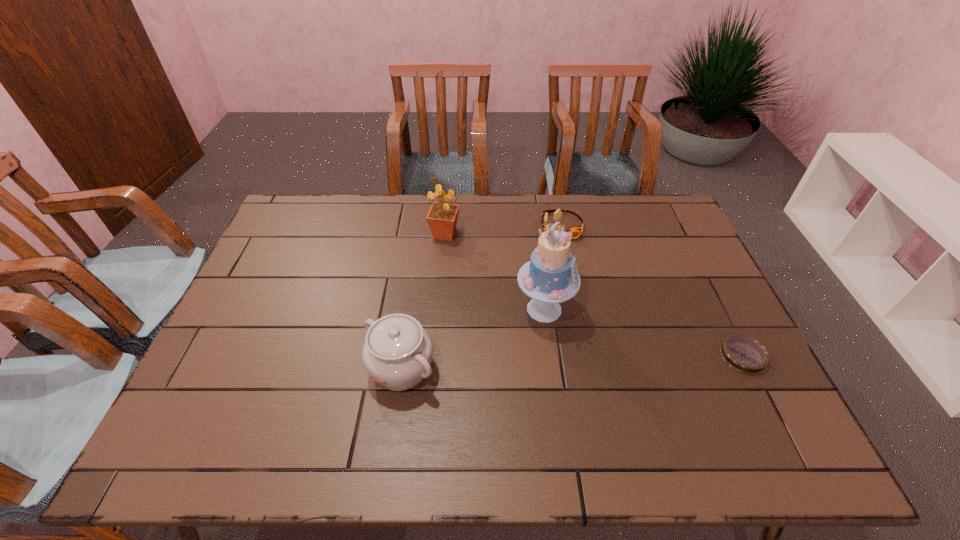
What are the coordinates of `vacant region located 0.340m at the front of the second tallest object with flowers visible` in the screenshot? It's located at (518, 307).

I want to click on vacant region located at the front of the second tallest object with flowers visible, so click(x=502, y=290).

The height and width of the screenshot is (540, 960). Find the location of `free space located with a ladder on the side of the third farthest object`. free space located with a ladder on the side of the third farthest object is located at coordinates (649, 395).

Where is `free region located with a ladder on the side of the third farthest object`? The image size is (960, 540). free region located with a ladder on the side of the third farthest object is located at coordinates (649, 395).

Image resolution: width=960 pixels, height=540 pixels. In order to click on blank area located 0.200m with a ladder on the side of the third farthest object in this screenshot , I will do `click(626, 376)`.

Where is `free space located with the lenses facing forward on the second shortest object`? free space located with the lenses facing forward on the second shortest object is located at coordinates (570, 264).

Where is `free space located with the lenses facing forward on the second shortest object`? free space located with the lenses facing forward on the second shortest object is located at coordinates (583, 315).

Identify the location of vacant space located 0.320m with the lenses facing forward on the second shortest object. This screenshot has width=960, height=540. (583, 315).

Find the location of a particular element. Image resolution: width=960 pixels, height=540 pixels. sunflower that is positioned at the far edge is located at coordinates (442, 217).

This screenshot has width=960, height=540. In order to click on goggles at the far edge in this screenshot , I will do `click(576, 231)`.